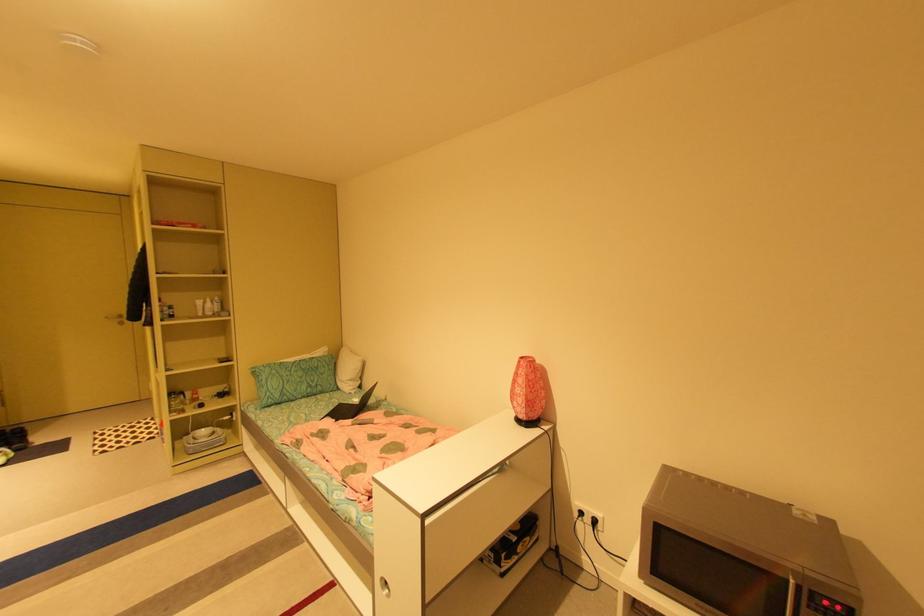
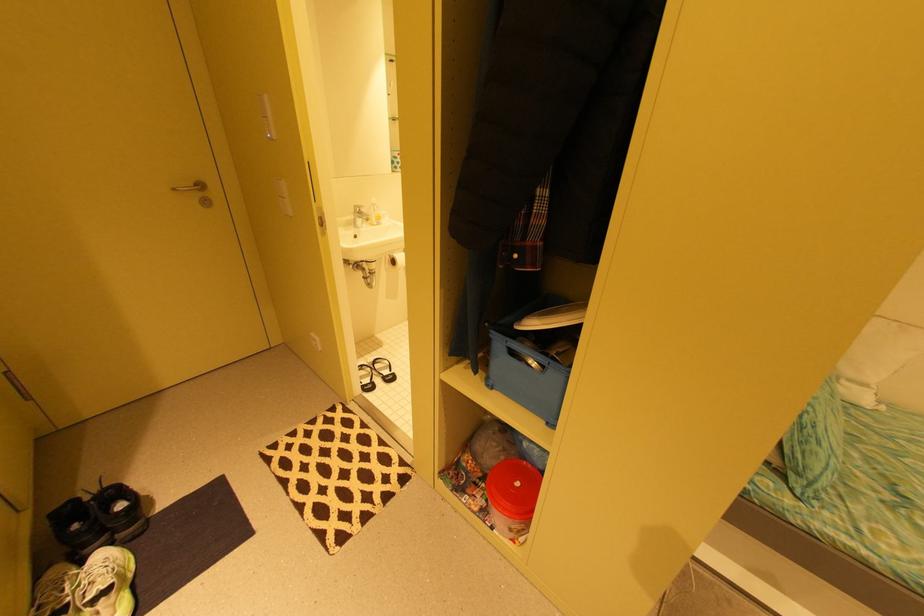
In the second image, find the point that corresponds to point 113,318 in the first image.

(179, 190)